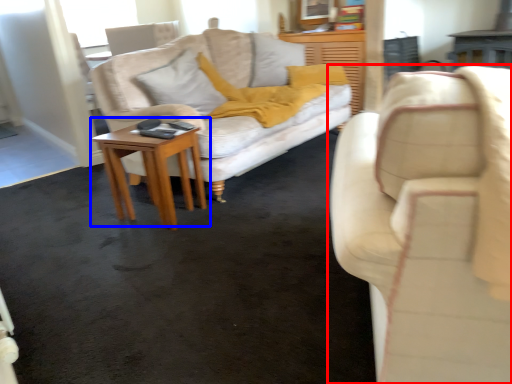
Question: Which object appears farthest to the camera in this image, studio couch (highlighted by a red box) or table (highlighted by a blue box)?

Choices:
 (A) studio couch
 (B) table

Answer: (B)